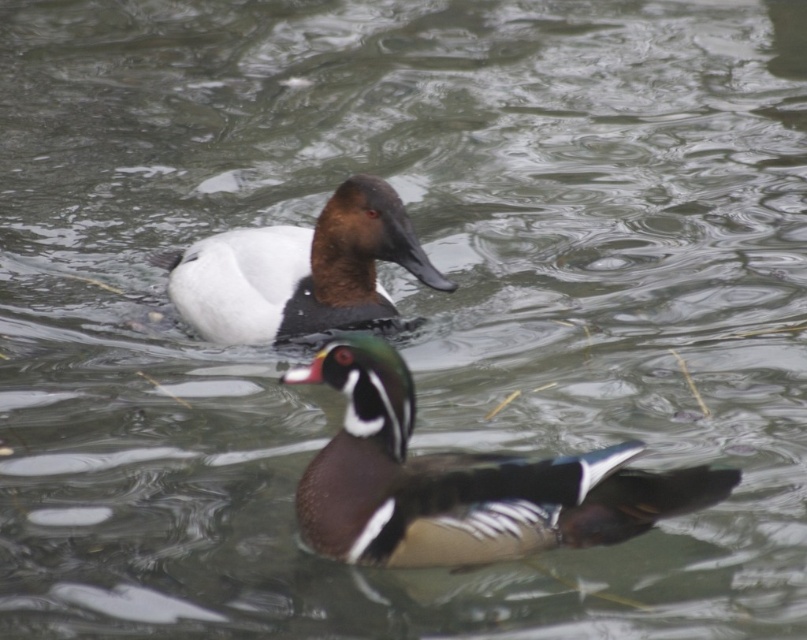
Question: Is shiny brown duck at center smaller than white matte duck at upper center?

Choices:
 (A) no
 (B) yes

Answer: (B)

Question: Does shiny brown duck at center have a smaller size compared to white matte duck at upper center?

Choices:
 (A) yes
 (B) no

Answer: (A)

Question: Which point appears closest to the camera in this image?

Choices:
 (A) (358, 438)
 (B) (187, 259)

Answer: (A)

Question: Is shiny brown duck at center positioned at the back of white matte duck at upper center?

Choices:
 (A) no
 (B) yes

Answer: (A)

Question: Which of the following is the closest to the observer?

Choices:
 (A) (402, 212)
 (B) (442, 554)

Answer: (B)